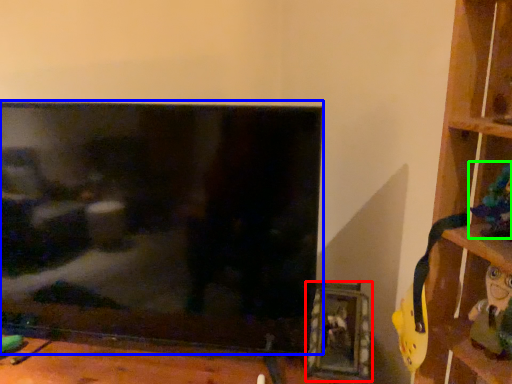
Question: Which object is positioned closest to picture frame (highlighted by a red box)? Select from television (highlighted by a blue box) and toy (highlighted by a green box).

Choices:
 (A) television
 (B) toy

Answer: (A)